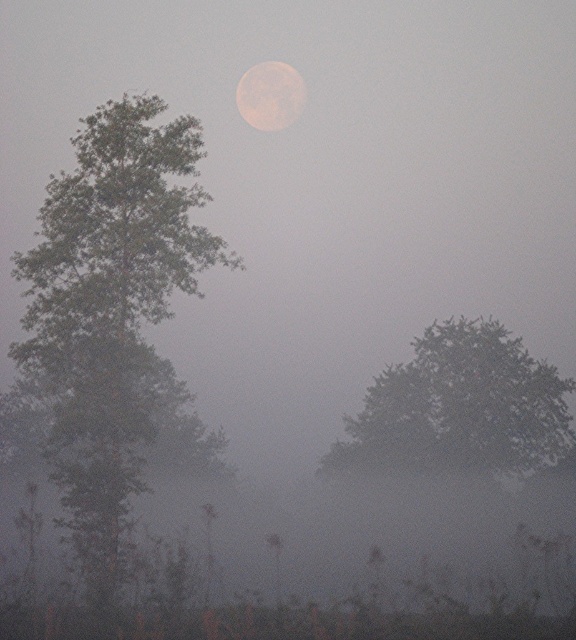
Question: Can you confirm if green leafy tree at left is smaller than green matte tree at center?

Choices:
 (A) no
 (B) yes

Answer: (A)

Question: Does green leafy tree at left come behind green matte tree at center?

Choices:
 (A) no
 (B) yes

Answer: (A)

Question: Considering the real-world distances, which object is closest to the green matte tree at center?

Choices:
 (A) smooth gray moon at upper center
 (B) green leafy tree at left

Answer: (B)

Question: Is green leafy tree at left closer to the viewer compared to smooth gray moon at upper center?

Choices:
 (A) yes
 (B) no

Answer: (A)

Question: Which object appears farthest from the camera in this image?

Choices:
 (A) green matte tree at center
 (B) smooth gray moon at upper center
 (C) green leafy tree at left

Answer: (B)

Question: Which object appears closest to the camera in this image?

Choices:
 (A) green leafy tree at left
 (B) smooth gray moon at upper center
 (C) green matte tree at center

Answer: (A)